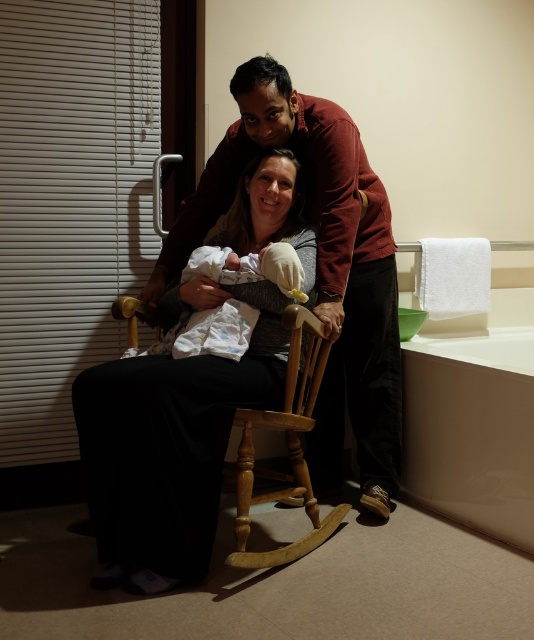
Question: Does matte brown rocking chair at center appear on the left side of white soft cloth at center?

Choices:
 (A) yes
 (B) no

Answer: (B)

Question: Among these points, which one is nearest to the camera?

Choices:
 (A) (269, 342)
 (B) (276, 388)

Answer: (B)

Question: Is matte brown rocking chair at center wider than white soft cloth at center?

Choices:
 (A) yes
 (B) no

Answer: (A)

Question: Which of the following is the closest to the observer?

Choices:
 (A) click(x=255, y=296)
 (B) click(x=364, y=465)

Answer: (A)

Question: Which of the following is the farthest from the observer?

Choices:
 (A) matte brown rocking chair at center
 (B) white soft cloth at center

Answer: (B)

Question: Is matte brown rocking chair at center bigger than white soft cloth at center?

Choices:
 (A) yes
 (B) no

Answer: (A)